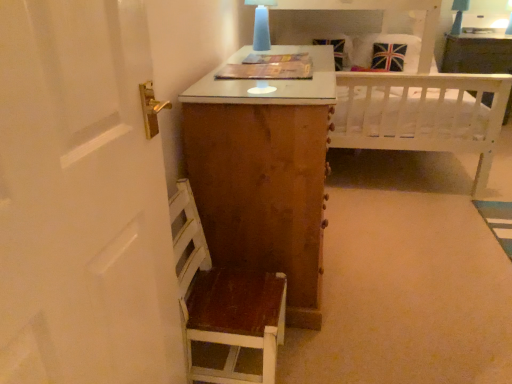
Locate an element on the screen. This screenshot has width=512, height=384. vacant space to the right of wooden chair at lower left is located at coordinates (316, 351).